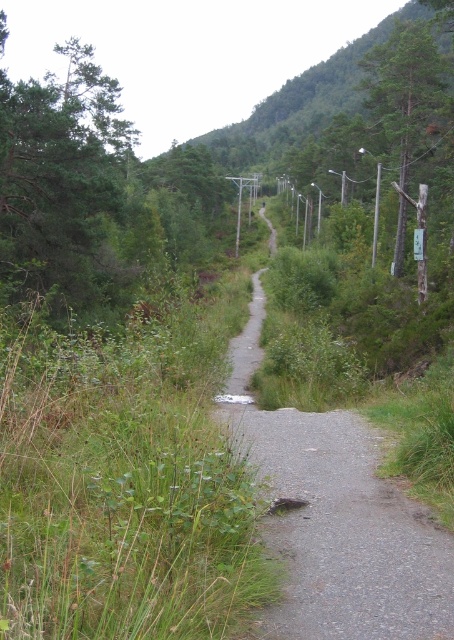
Does green leafy hillside at upper center have a smaller size compared to green matte tree at upper right?

Incorrect, green leafy hillside at upper center is not smaller in size than green matte tree at upper right.

Is green leafy hillside at upper center behind green matte tree at upper right?

Yes, it is behind green matte tree at upper right.

What do you see at coordinates (304, 99) in the screenshot?
I see `green leafy hillside at upper center` at bounding box center [304, 99].

Find the location of `green leafy hillside at upper center`. green leafy hillside at upper center is located at coordinates (304, 99).

Does gray gravel path at center have a smaller size compared to green matte tree at upper right?

Yes, gray gravel path at center is smaller than green matte tree at upper right.

Is point (368, 582) closer to viewer compared to point (423, 76)?

Yes, point (368, 582) is in front of point (423, 76).

Is point (243, 333) farther from camera compared to point (375, 74)?

That is False.

Image resolution: width=454 pixels, height=640 pixels. What are the coordinates of `gray gravel path at center` in the screenshot? It's located at (336, 518).

Is green matte tree at upper right smaller than smooth wooden post at right?

Incorrect, green matte tree at upper right is not smaller in size than smooth wooden post at right.

Does green matte tree at upper right have a lesser height compared to smooth wooden post at right?

Incorrect, green matte tree at upper right's height does not fall short of smooth wooden post at right's.

I want to click on green matte tree at upper right, so click(x=405, y=88).